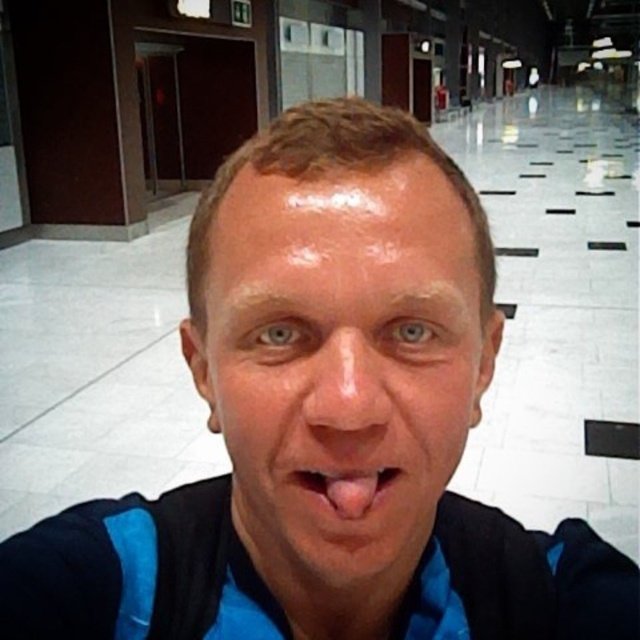
You are a photographer trying to capture the perfect shot of the smooth skin face at center and the smooth skin nose at center. Since you want to highlight both features, you need to ensure they are aligned properly. Based on their positions, which one should you focus on first to frame the shot correctly?

The smooth skin face at center is to the left of the smooth skin nose at center, so you should focus on the smooth skin face at center first to frame the shot correctly.

Based on the scene description, can you determine if the smooth skin face at center is wider than the smooth skin nose at center?

The smooth skin face at center is wider than the smooth skin nose at center according to the description.

From the picture: You are a photographer trying to align a subject in the center of your shot. The subject has a smooth skin face at center. Based on the scene description, where should you position the camera to ensure the face is centered?

The smooth skin face at center is located at point 2D coordinates of (340, 364). To center the face, position the camera so that the face aligns with the center point of the frame, which is typically at coordinates (320, 320). Adjust the camera slightly to the left and up to move the face closer to the true center.